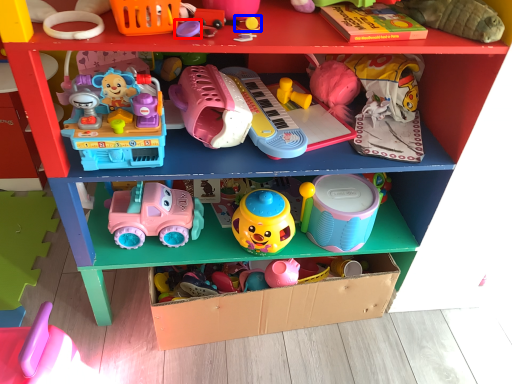
Question: Which point is closer to the camera, toy (highlighted by a red box) or toy (highlighted by a blue box)?

Choices:
 (A) toy
 (B) toy

Answer: (A)